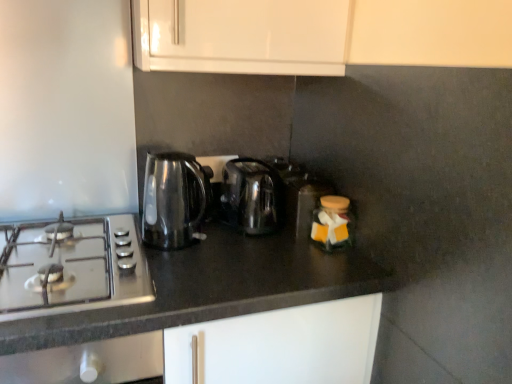
The image size is (512, 384). I want to click on free spot to the right of transparent glass kettle at left, acting as the 1th kitchen appliance starting from the left, so click(x=233, y=250).